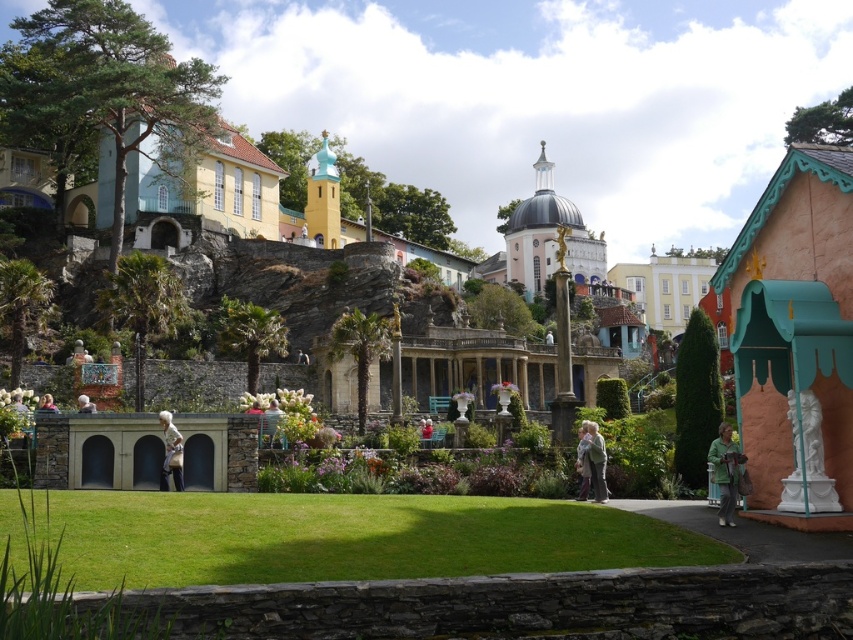
Which is more to the right, green textured coat at center or light brown leather jacket at center?

green textured coat at center is more to the right.

Is green textured coat at center positioned before light brown leather jacket at center?

That is True.

This screenshot has height=640, width=853. What are the coordinates of `green textured coat at center` in the screenshot? It's located at (592, 461).

Find the location of a particular element. The image size is (853, 640). green textured coat at center is located at coordinates (592, 461).

Who is higher up, matte gray jacket at lower right or white fabric bag at center?

Positioned higher is white fabric bag at center.

Is matte gray jacket at lower right smaller than white fabric bag at center?

No.

Image resolution: width=853 pixels, height=640 pixels. In order to click on matte gray jacket at lower right in this screenshot , I will do `click(724, 472)`.

Which is below, white fabric dress at center or white fabric bag at center?

Positioned lower is white fabric dress at center.

Does white fabric dress at center appear on the left side of white fabric bag at center?

No, white fabric dress at center is not to the left of white fabric bag at center.

Describe the element at coordinates (170, 452) in the screenshot. The height and width of the screenshot is (640, 853). I see `white fabric dress at center` at that location.

Identify the location of white fabric dress at center. (170, 452).